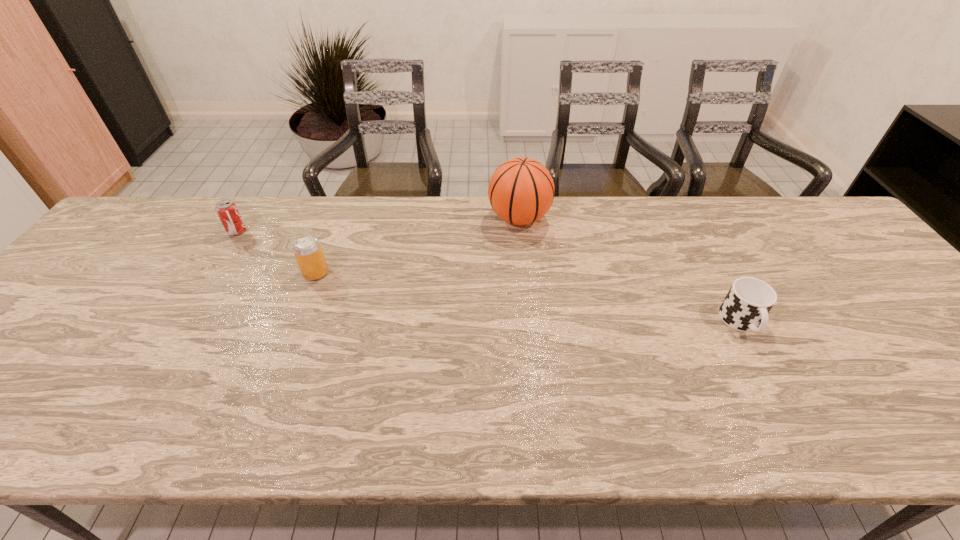
The image size is (960, 540). What are the coordinates of `free space between the third object from left to right and the leftmost object` in the screenshot? It's located at (378, 225).

Where is `free space between the third farthest object and the leftmost object`? free space between the third farthest object and the leftmost object is located at coordinates (276, 252).

Locate an element on the screen. Image resolution: width=960 pixels, height=540 pixels. unoccupied area between the nearest object and the basketball is located at coordinates (x=630, y=271).

Identify the location of free space between the second object from left to right and the leftmost object. (276, 252).

At what (x,y) coordinates should I click in order to perform the action: click on vacant area that lies between the rightmost object and the second nearest object. Please return your answer as a coordinate pair (x, y). The width and height of the screenshot is (960, 540). Looking at the image, I should click on (529, 298).

Locate an element on the screen. The width and height of the screenshot is (960, 540). unoccupied area between the right soda can and the tallest object is located at coordinates (418, 246).

Identify the location of vacant point located between the nearest object and the leftmost object. (490, 277).

Locate an element on the screen. The image size is (960, 540). free space that is in between the right soda can and the basketball is located at coordinates (418, 246).

The width and height of the screenshot is (960, 540). Identify the location of object that can be found as the closest to the nearer soda can. (226, 209).

Identify which object is located as the third nearest to the third object from left to right. Please provide its 2D coordinates. Your answer should be formatted as a tuple, i.e. [(x, y)], where the tuple contains the x and y coordinates of a point satisfying the conditions above.

[(226, 209)]